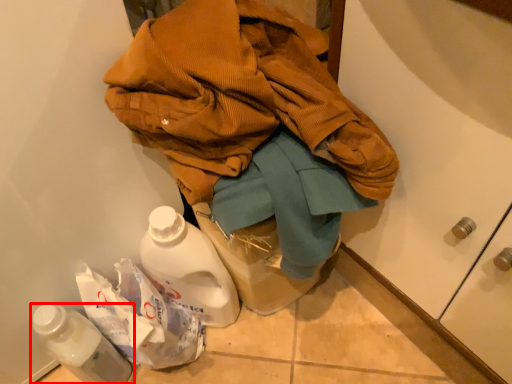
Question: From the image's perspective, where is bottle (annotated by the red box) located in relation to jacket in the image?

Choices:
 (A) below
 (B) above

Answer: (A)